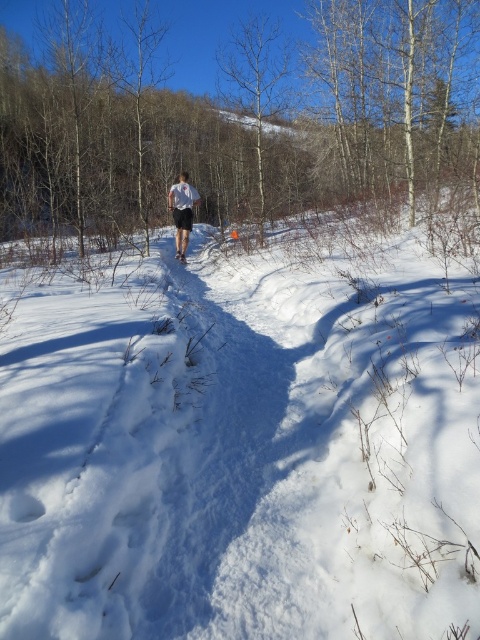
You are standing at the edge of the snowy path and notice the white fluffy snow at center and the white matte shorts at center. Which object is closer to you?

The white fluffy snow at center is in front of the white matte shorts at center, so it is closer to you.

You are standing at the starting point of the path and want to reach the white fluffy snow at center. The white matte shorts at center is blocking your way. Can you walk around it without stepping on the snow?

The white fluffy snow at center is 4.01 meters away from the white matte shorts at center. Since the distance between them is more than 4 meters, you can walk around the white matte shorts at center without stepping on the snow.